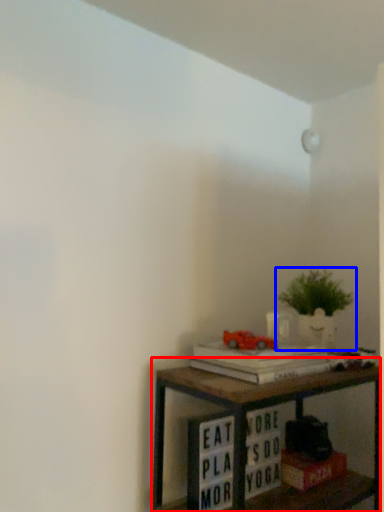
Question: Which point is further to the camera, shelf (highlighted by a red box) or houseplant (highlighted by a blue box)?

Choices:
 (A) shelf
 (B) houseplant

Answer: (B)